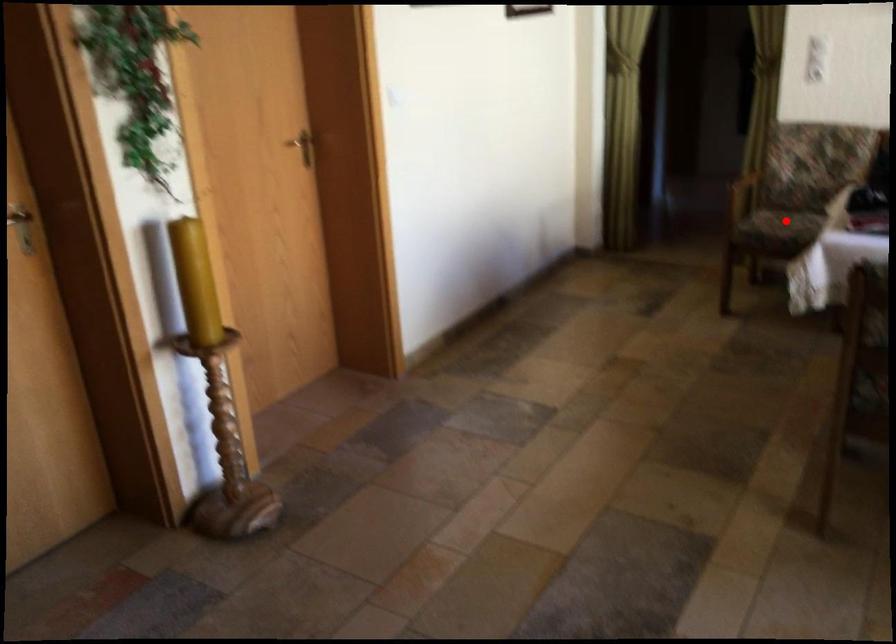
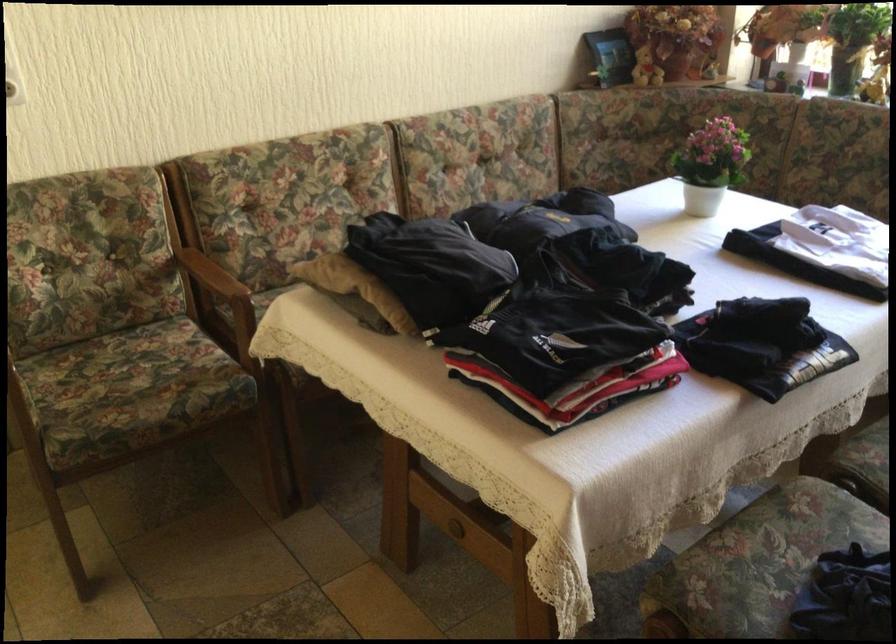
Question: I am providing you with two images of the same scene from different viewpoints. Given a red point in image1, look at the same physical point in image2. Is it:

Choices:
 (A) Closer to the viewpoint
 (B) Farther from the viewpoint

Answer: (A)